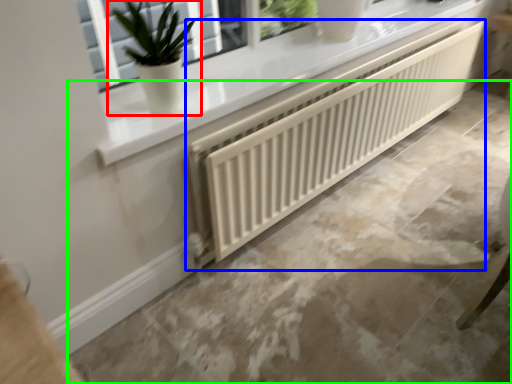
Question: Estimate the real-world distances between objects in this image. Which object is farther from houseplant (highlighted by a red box), radiator (highlighted by a blue box) or concrete (highlighted by a green box)?

Choices:
 (A) radiator
 (B) concrete

Answer: (B)